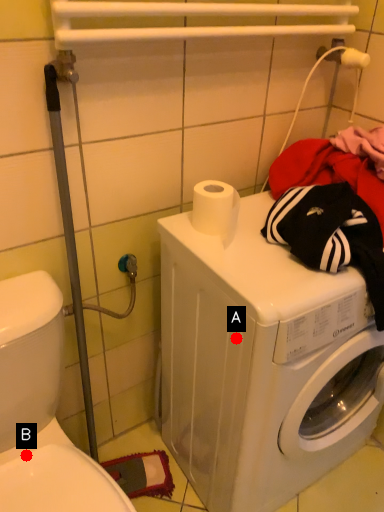
Question: Two points are circled on the image, labeled by A and B beside each circle. Among these points, which one is nearest to the camera?

Choices:
 (A) A is closer
 (B) B is closer

Answer: (A)